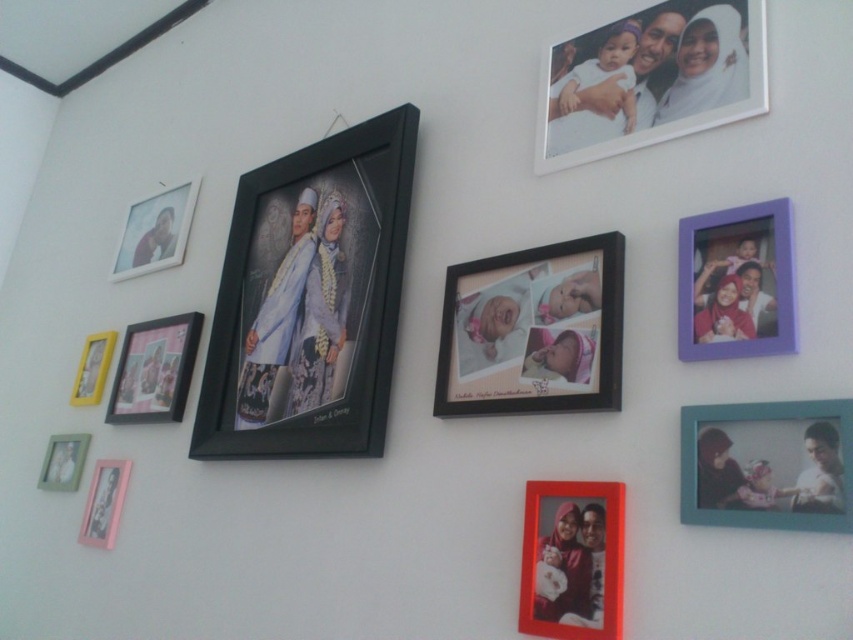
Measure the distance between point [372,321] and camera.

A distance of 4.11 feet exists between point [372,321] and camera.

In the scene shown: Can you confirm if black matte picture frame at center is positioned to the left of pink matte picture frame at left?

No, black matte picture frame at center is not to the left of pink matte picture frame at left.

Is point (350, 198) closer to viewer compared to point (154, 321)?

Yes, point (350, 198) is in front of point (154, 321).

Find the location of `black matte picture frame at center`. black matte picture frame at center is located at coordinates (310, 298).

Does black matte picture frame at center appear under purple plastic picture frame at upper right?

No, black matte picture frame at center is not below purple plastic picture frame at upper right.

Which is more to the right, black matte picture frame at center or purple plastic picture frame at upper right?

Positioned to the right is purple plastic picture frame at upper right.

The height and width of the screenshot is (640, 853). What are the coordinates of `black matte picture frame at center` in the screenshot? It's located at (310, 298).

You are a GUI agent. You are given a task and a screenshot of the screen. Output one action in this format:
    pyautogui.click(x=<x>, y=<y>)
    Task: Click on the black matte picture frame at center
    This screenshot has width=853, height=640.
    Given the screenshot: What is the action you would take?
    pyautogui.click(x=310, y=298)

Does white matte photo frame at upper right have a larger size compared to matte black frame at upper left?

Incorrect, white matte photo frame at upper right is not larger than matte black frame at upper left.

Does point (664, 40) come farther from viewer compared to point (157, 243)?

No, it is not.

This screenshot has height=640, width=853. I want to click on white matte photo frame at upper right, so click(x=651, y=80).